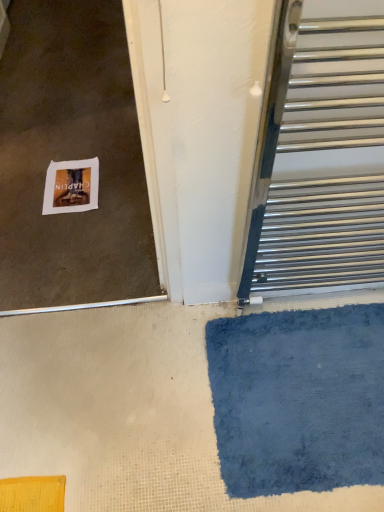
This screenshot has width=384, height=512. What are the coordinates of `free space above blue plush bath mat at lower right (from a real-world perspective)` in the screenshot? It's located at (320, 376).